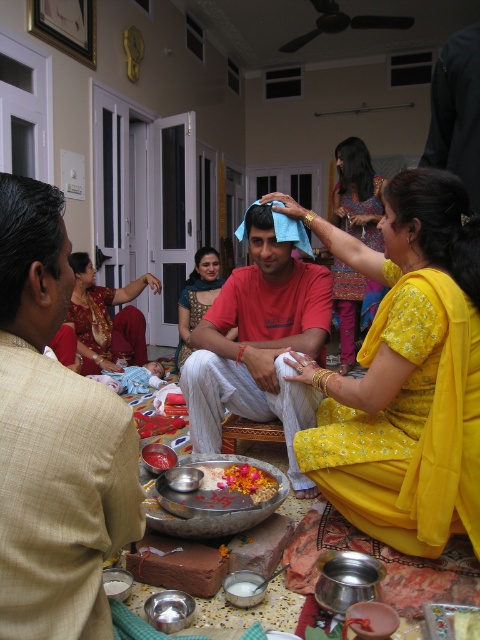
Is point (3, 564) farther from camera compared to point (346, 321)?

No.

Does beige textured suit at left have a greater height compared to printed cotton saree at upper right?

No, beige textured suit at left is not taller than printed cotton saree at upper right.

Does point (58, 504) lie behind point (367, 312)?

No, (58, 504) is closer to viewer.

Where is `beige textured suit at left`? beige textured suit at left is located at coordinates pyautogui.click(x=54, y=440).

Is yellow floral fabric at center wider than printed cotton saree at upper right?

Yes, yellow floral fabric at center is wider than printed cotton saree at upper right.

Can you confirm if yellow floral fabric at center is positioned to the left of printed cotton saree at upper right?

Yes, yellow floral fabric at center is to the left of printed cotton saree at upper right.

Find the location of a particular element. yellow floral fabric at center is located at coordinates (406, 374).

Who is taller, yellow floral fabric at center or yellow floral saree at center?

yellow floral fabric at center is taller.

The width and height of the screenshot is (480, 640). What do you see at coordinates (406, 374) in the screenshot?
I see `yellow floral fabric at center` at bounding box center [406, 374].

Find the location of `yellow floral fabric at center`. yellow floral fabric at center is located at coordinates (406, 374).